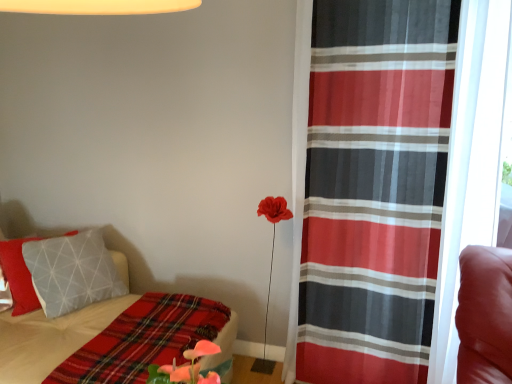
Question: Considering the relative sizes of red sheer curtain at right and plaid fabric blanket at lower left in the image provided, is red sheer curtain at right bigger than plaid fabric blanket at lower left?

Choices:
 (A) yes
 (B) no

Answer: (A)

Question: From the image's perspective, does red sheer curtain at right appear lower than plaid fabric blanket at lower left?

Choices:
 (A) yes
 (B) no

Answer: (B)

Question: Can you confirm if red sheer curtain at right is smaller than plaid fabric blanket at lower left?

Choices:
 (A) yes
 (B) no

Answer: (B)

Question: From a real-world perspective, is red sheer curtain at right positioned under plaid fabric blanket at lower left based on gravity?

Choices:
 (A) yes
 (B) no

Answer: (B)

Question: Is red sheer curtain at right located outside plaid fabric blanket at lower left?

Choices:
 (A) yes
 (B) no

Answer: (A)

Question: From a real-world perspective, is red sheer curtain at right on plaid fabric blanket at lower left?

Choices:
 (A) no
 (B) yes

Answer: (B)

Question: Does plaid fabric blanket at lower left have a smaller size compared to red sheer curtain at right?

Choices:
 (A) yes
 (B) no

Answer: (A)

Question: Is plaid fabric blanket at lower left to the left of red sheer curtain at right from the viewer's perspective?

Choices:
 (A) no
 (B) yes

Answer: (B)

Question: Is plaid fabric blanket at lower left far from red sheer curtain at right?

Choices:
 (A) yes
 (B) no

Answer: (B)

Question: Is plaid fabric blanket at lower left positioned with its back to red sheer curtain at right?

Choices:
 (A) yes
 (B) no

Answer: (B)

Question: Is plaid fabric blanket at lower left in front of red sheer curtain at right?

Choices:
 (A) no
 (B) yes

Answer: (B)

Question: Is plaid fabric blanket at lower left aimed at red sheer curtain at right?

Choices:
 (A) yes
 (B) no

Answer: (B)

Question: From a real-world perspective, does plaid fabric blanket at lower left sit lower than plaid fabric bed at lower left?

Choices:
 (A) no
 (B) yes

Answer: (A)